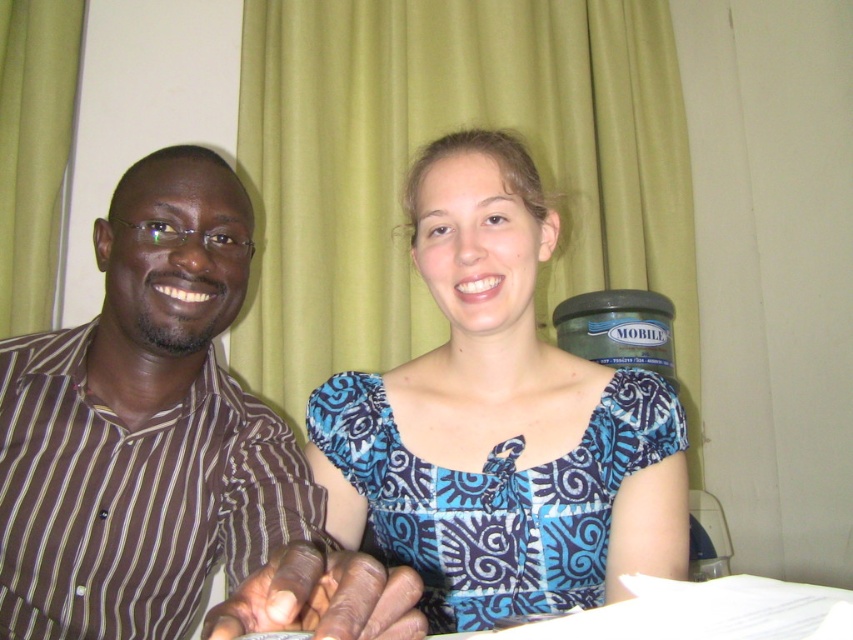
Is brown striped shirt at left positioned at the back of blue printed dress at center?

No, brown striped shirt at left is in front of blue printed dress at center.

The image size is (853, 640). In order to click on brown striped shirt at left in this screenshot , I will do `click(167, 449)`.

Identify the location of brown striped shirt at left. Image resolution: width=853 pixels, height=640 pixels. (167, 449).